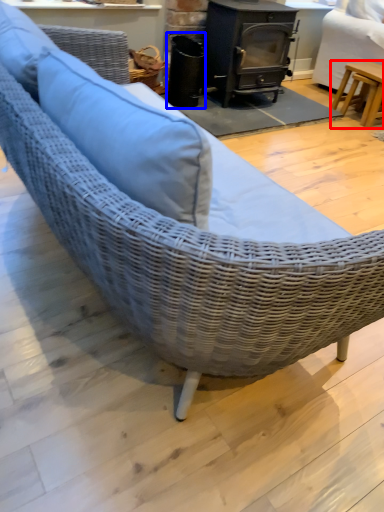
Question: Which of the following is the farthest to the observer, table (highlighted by a red box) or appliance (highlighted by a blue box)?

Choices:
 (A) table
 (B) appliance

Answer: (A)